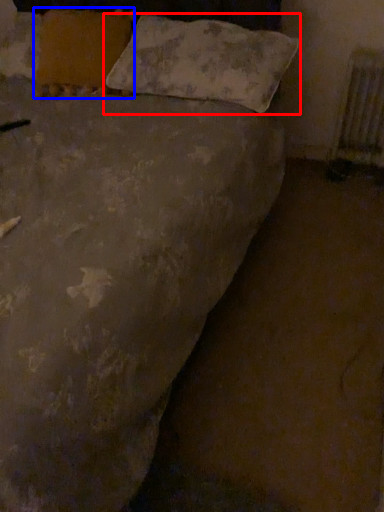
Question: Which point is further to the camera, pillow (highlighted by a red box) or pillow (highlighted by a blue box)?

Choices:
 (A) pillow
 (B) pillow

Answer: (B)